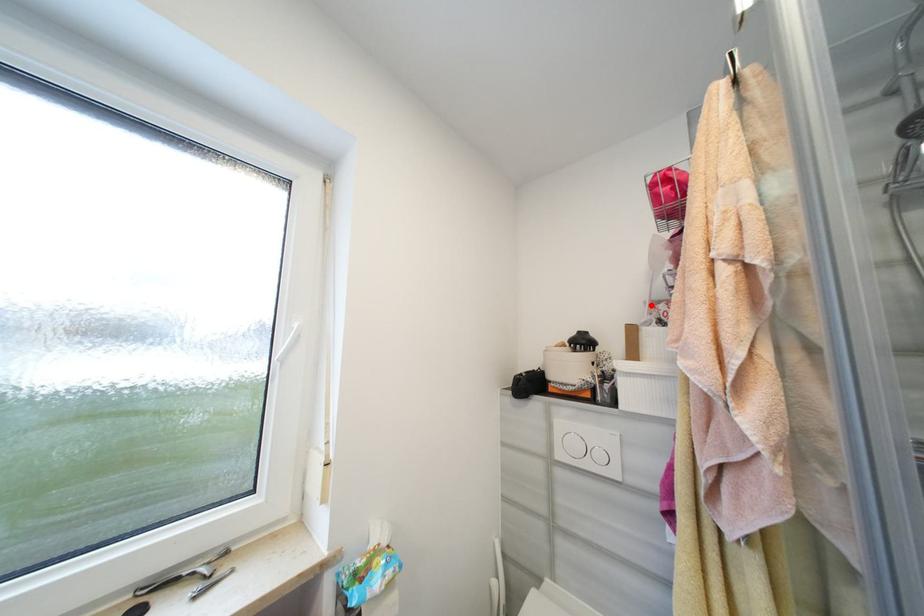
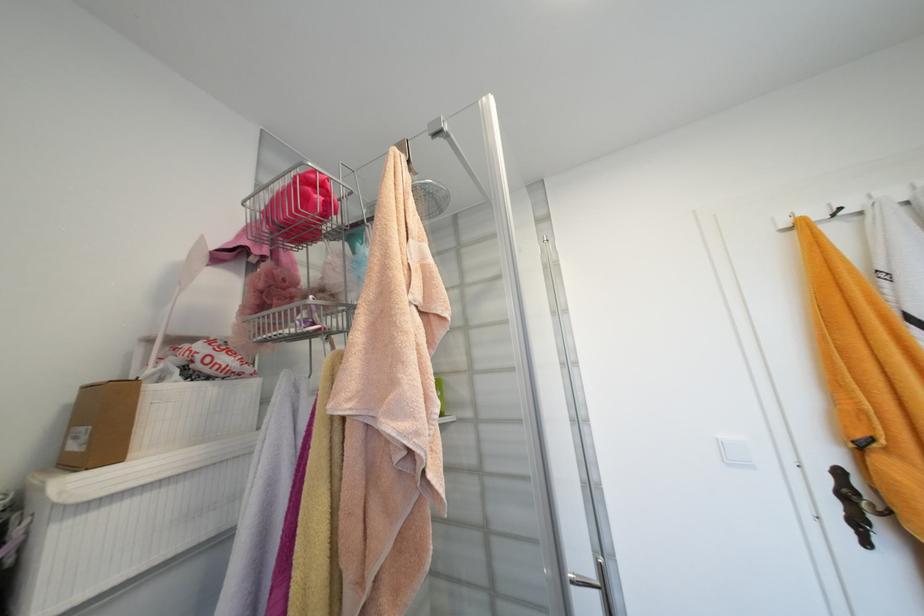
Locate, in the second image, the point that corresponds to the highlighted location in the first image.

(154, 342)